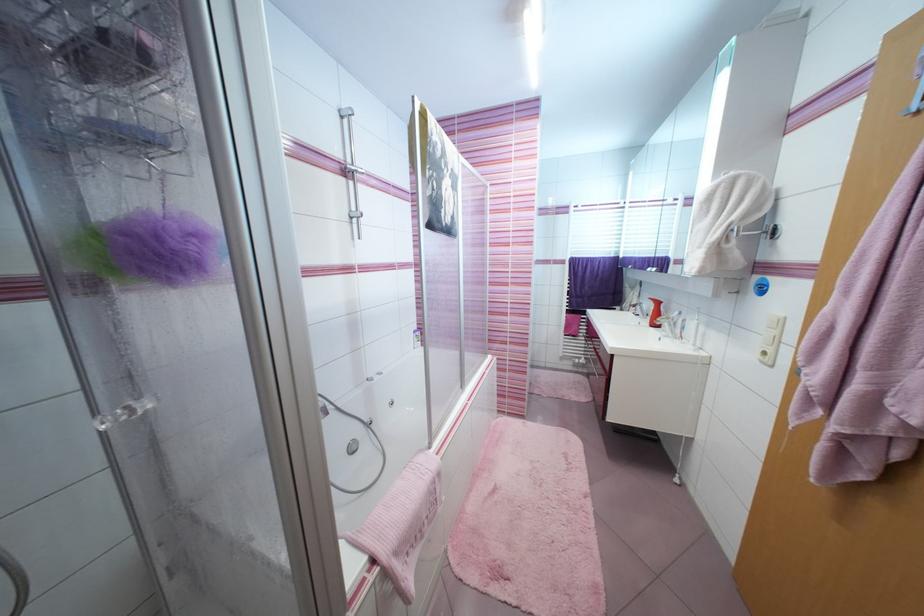
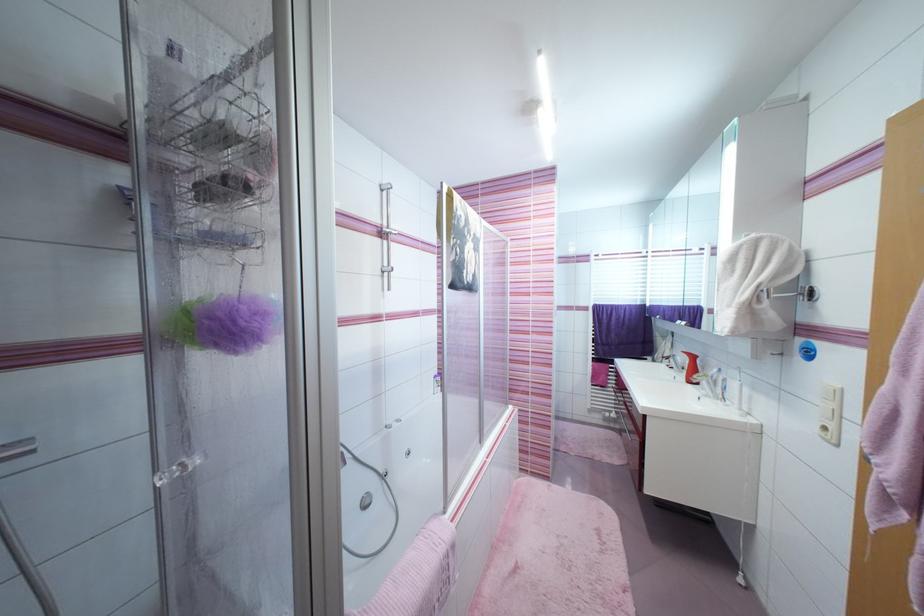
Locate, in the second image, the point that corresponds to point 649,294 in the first image.

(682, 345)